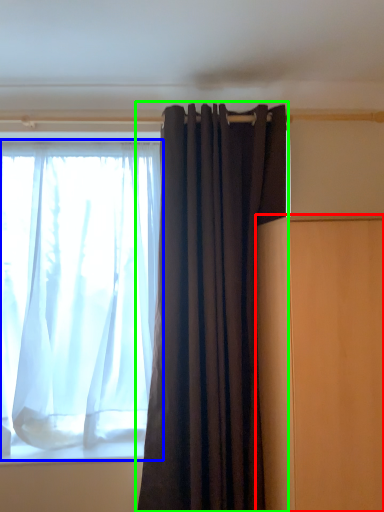
Question: Considering the real-world distances, which object is closest to furniture (highlighted by a red box)? curtain (highlighted by a blue box) or curtain (highlighted by a green box).

Choices:
 (A) curtain
 (B) curtain

Answer: (B)